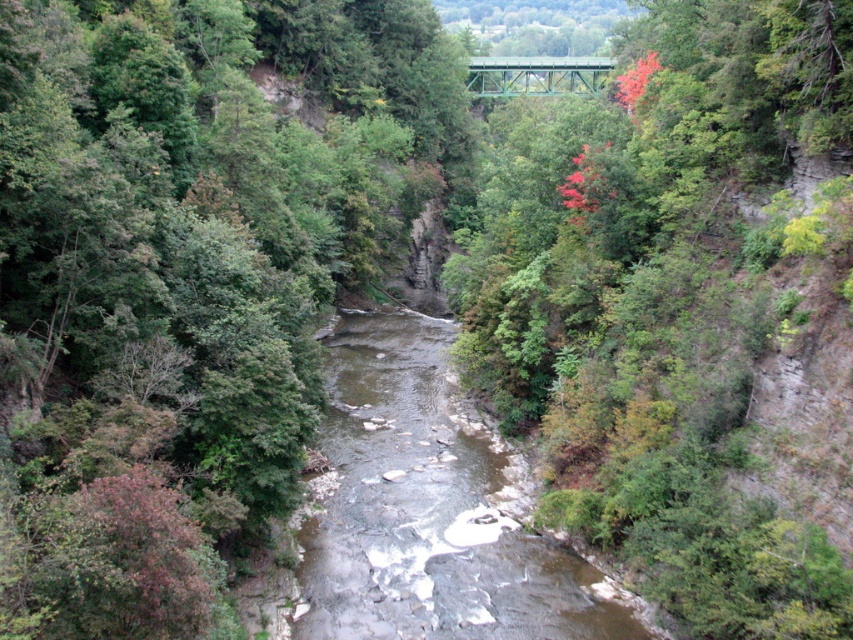
Is brown rocky stream at center to the right of green metal bridge at upper center from the viewer's perspective?

No, brown rocky stream at center is not to the right of green metal bridge at upper center.

Does point (431, 586) lie in front of point (578, 80)?

Yes, it is in front of point (578, 80).

Is point (477, 525) behind point (556, 88)?

No, (477, 525) is in front of (556, 88).

Locate an element on the screen. brown rocky stream at center is located at coordinates (428, 508).